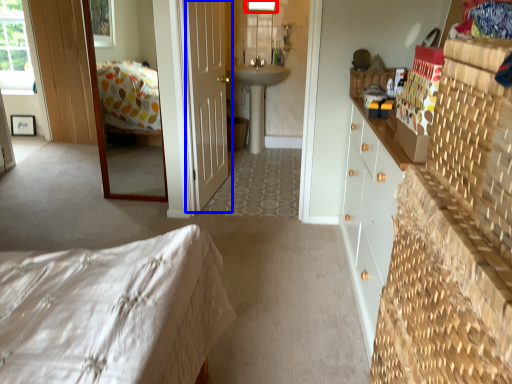
Question: Which object is further to the camera taking this photo, window (highlighted by a red box) or door (highlighted by a blue box)?

Choices:
 (A) window
 (B) door

Answer: (A)